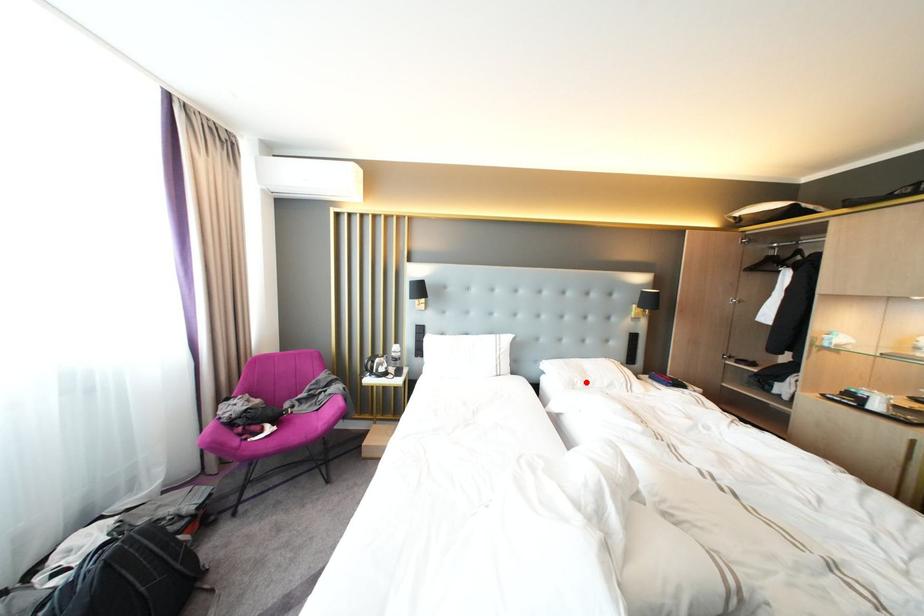
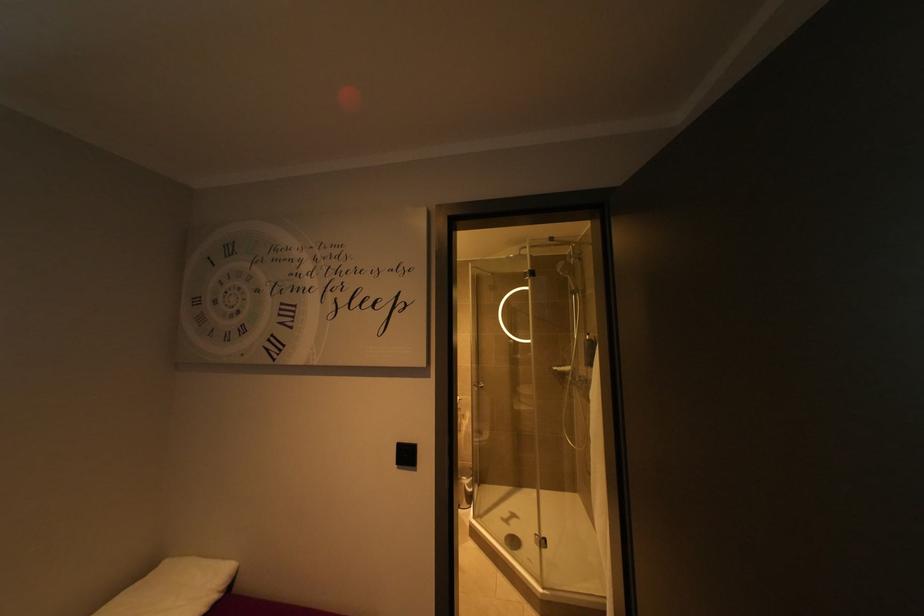
Question: I am providing you with two images of the same scene from different viewpoints. A red point is marked on the first image. Can you still see the location of the red point in image 2?

Choices:
 (A) Yes
 (B) No

Answer: (B)